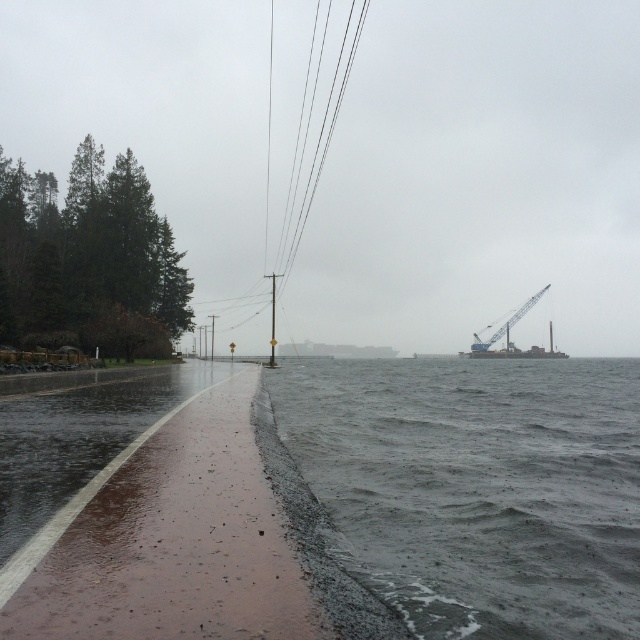
Measure the distance from black wire at center to metallic blue crane at right.

They are 83.97 meters apart.

Measure the distance between black wire at center and camera.

black wire at center is 66.72 meters away from camera.

Between point (276, 260) and point (481, 344), which one is positioned in front?

Point (481, 344)

Identify the location of black wire at center. [x=317, y=129].

What do you see at coordinates (476, 486) in the screenshot?
I see `dark gray water at lower right` at bounding box center [476, 486].

Where is `dark gray water at lower right`? dark gray water at lower right is located at coordinates (476, 486).

Between dark gray water at lower right and black wire at center, which one is positioned lower?

Positioned lower is dark gray water at lower right.

Is dark gray water at lower right shorter than black wire at center?

Yes.

The image size is (640, 640). I want to click on dark gray water at lower right, so click(476, 486).